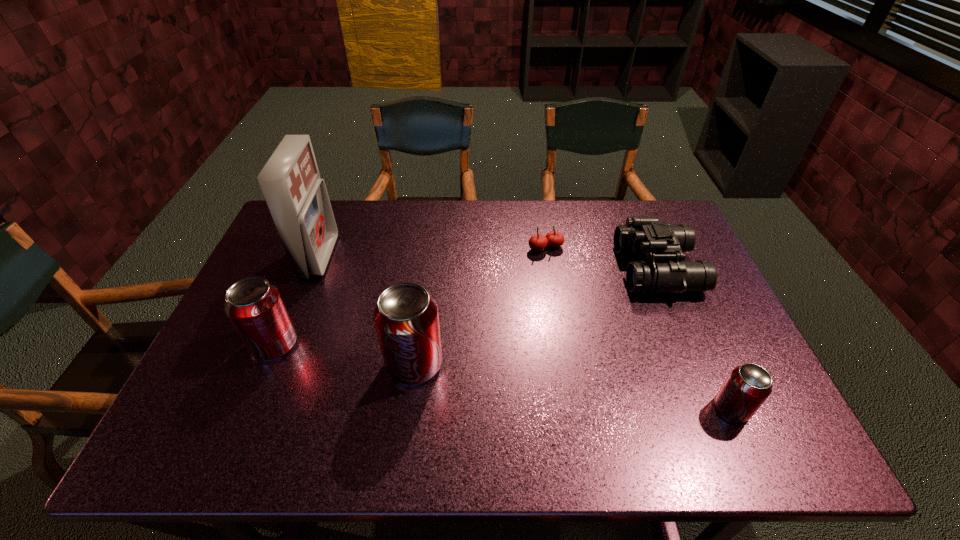
If equal spacing is the goal by inserting an additional pop_(soda) among them, please point out a vacant space for this new pop_(soda). Please provide its 2D coordinates. Your answer should be formatted as a tuple, i.e. [(x, y)], where the tuple contains the x and y coordinates of a point satisfying the conditions above.

[(566, 386)]